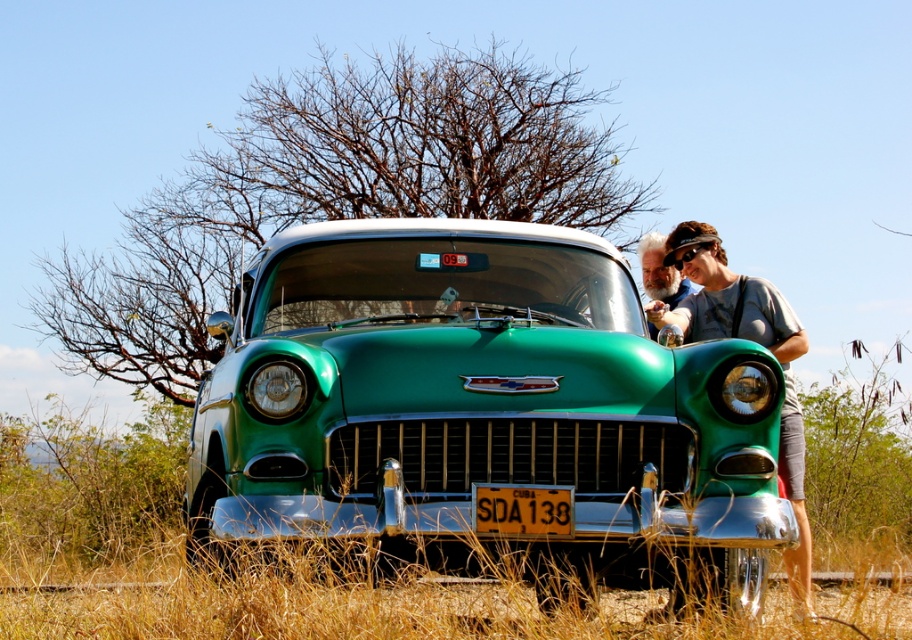
Question: Among these points, which one is farthest from the camera?

Choices:
 (A) (562, 500)
 (B) (701, 244)
 (C) (801, 570)
 (D) (649, 298)

Answer: (D)

Question: Which of these objects is positioned farthest from the green shiny car at center?

Choices:
 (A) black rubber sunglasses at upper center
 (B) yellow plastic license plate at center
 (C) matte gray shirt at right

Answer: (A)

Question: Is matte gray shirt at right wider than black rubber sunglasses at upper center?

Choices:
 (A) yes
 (B) no

Answer: (A)

Question: Is green shiny car at center wider than bearded man at center?

Choices:
 (A) no
 (B) yes

Answer: (B)

Question: Which object is positioned closest to the matte gray shirt at right?

Choices:
 (A) bearded man at center
 (B) black rubber sunglasses at upper center
 (C) green shiny car at center
 (D) yellow plastic license plate at center

Answer: (B)

Question: Does bearded man at center appear on the right side of black rubber sunglasses at upper center?

Choices:
 (A) no
 (B) yes

Answer: (A)